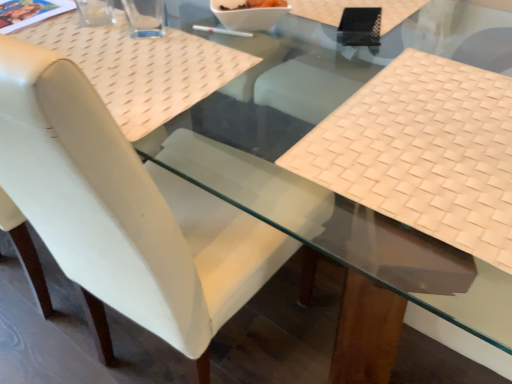
At what (x,y) coordinates should I click in order to perform the action: click on vacant space that is to the left of transparent glass at upper left, the 2th clear when ordered from left to right. Please return your answer as a coordinate pair (x, y). This screenshot has height=384, width=512. Looking at the image, I should click on (80, 31).